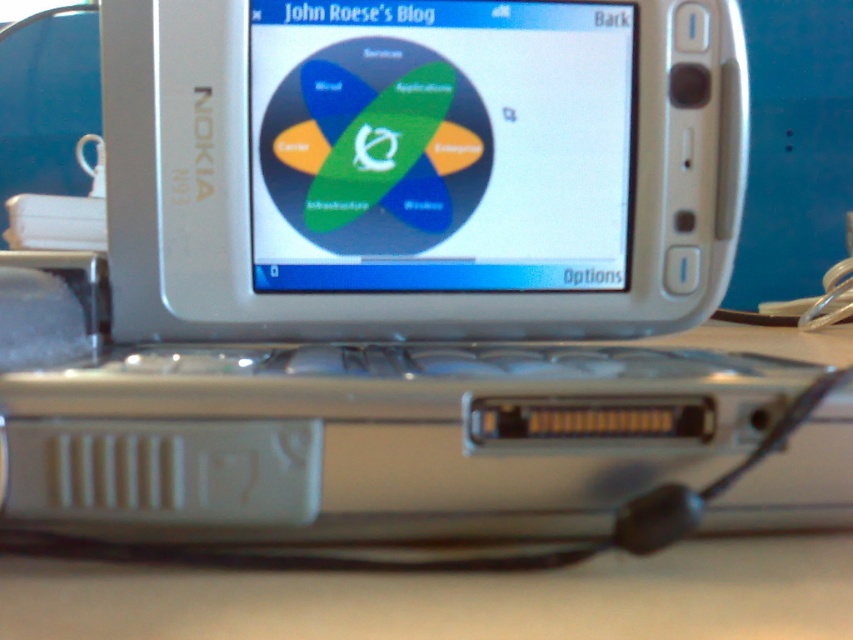
Question: Which object appears farthest from the camera in this image?

Choices:
 (A) matte plastic screen at center
 (B) white plastic table at lower center

Answer: (A)

Question: Can you confirm if matte plastic screen at center is positioned to the left of white plastic table at lower center?

Choices:
 (A) yes
 (B) no

Answer: (A)

Question: Is matte plastic screen at center positioned in front of white plastic table at lower center?

Choices:
 (A) yes
 (B) no

Answer: (B)

Question: Is matte plastic screen at center smaller than white plastic table at lower center?

Choices:
 (A) yes
 (B) no

Answer: (B)